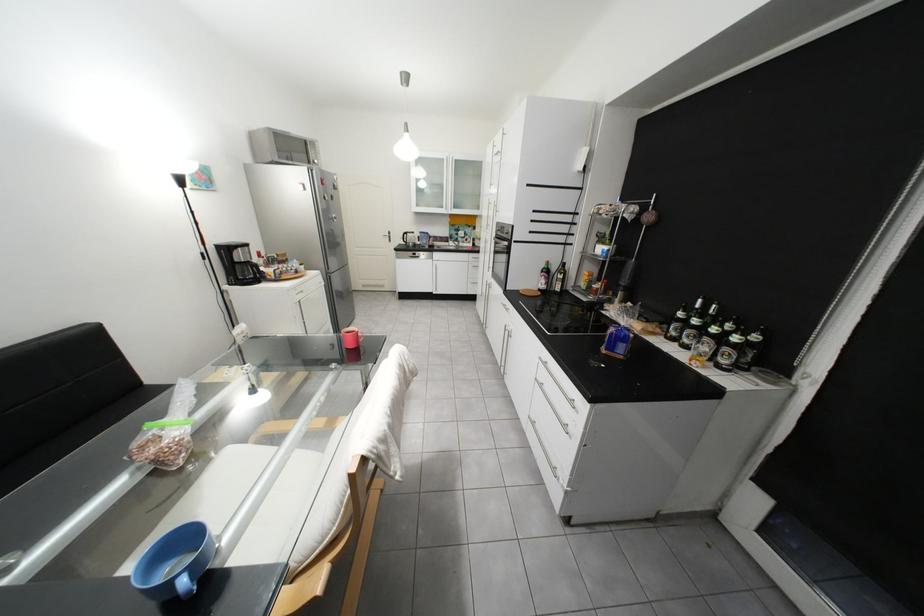
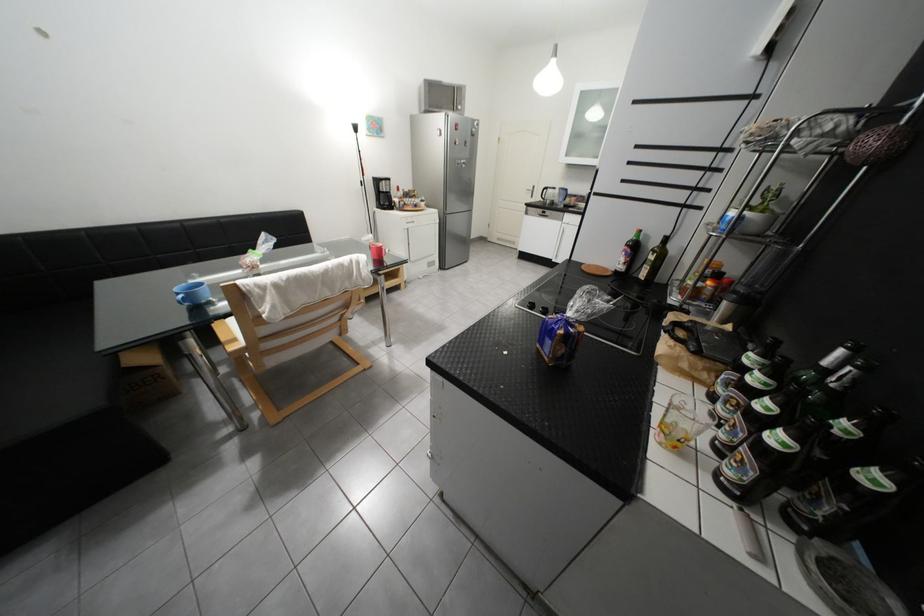
Where in the second image is the point corresponding to (643,336) from the first image?

(574, 333)